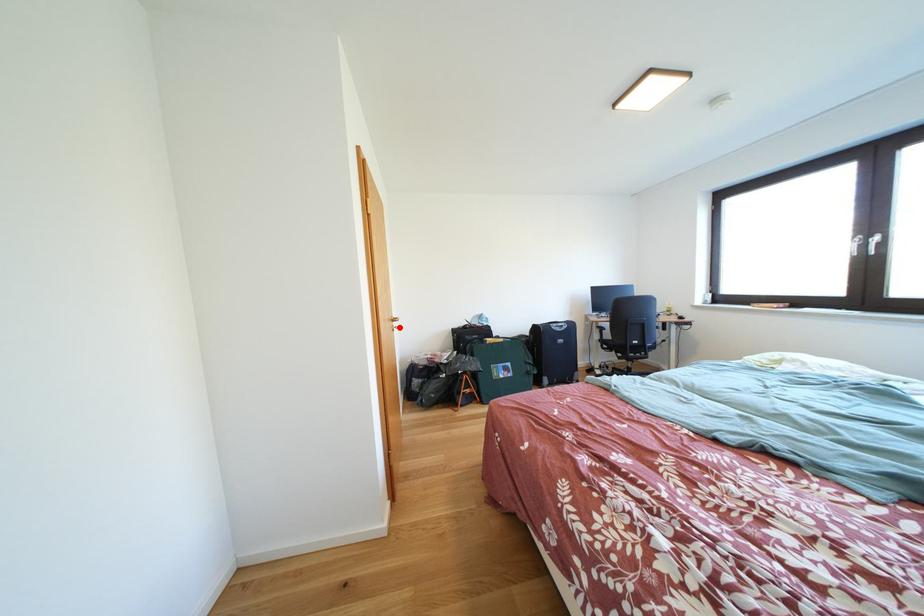
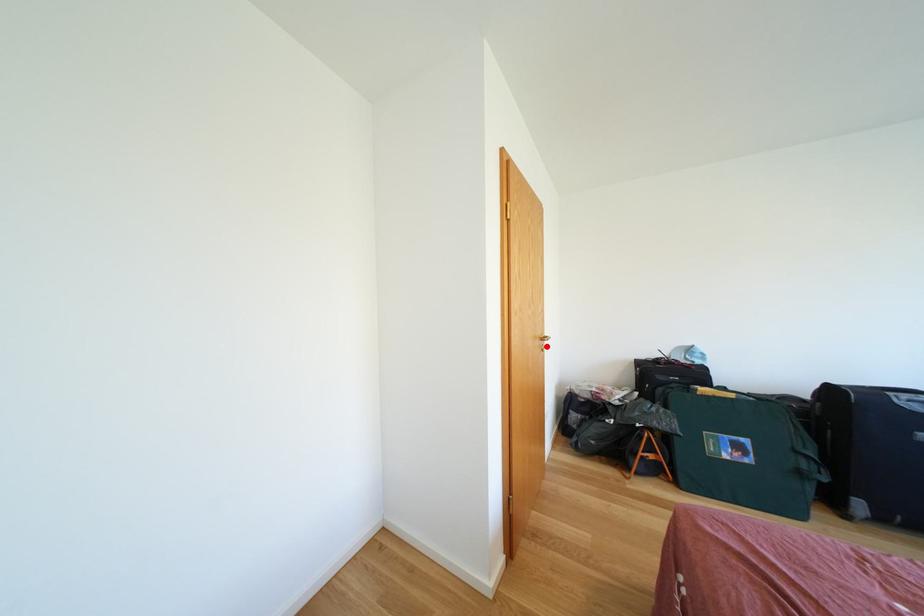
I am providing you with two images of the same scene from different viewpoints. A red point is marked on the first image and another point is marked on the second image. Are the points marked in image1 and image2 representing the same 3D position?

Yes